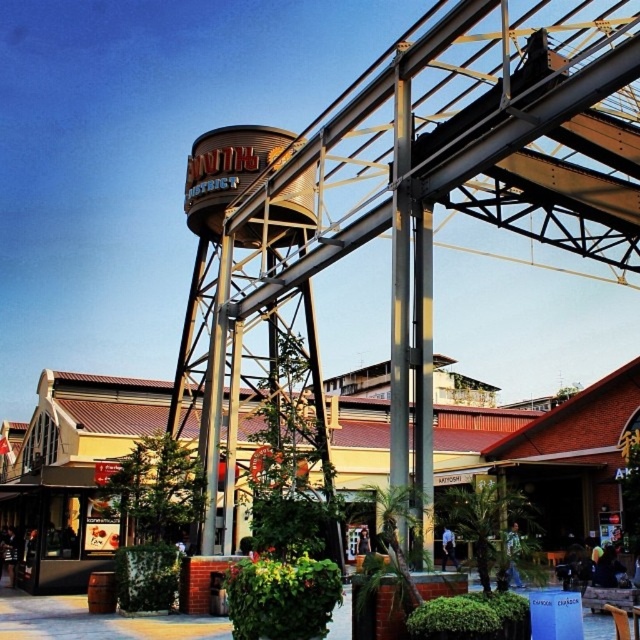
Question: Among these objects, which one is nearest to the camera?

Choices:
 (A) brown wooden amusement park at center
 (B) brown metallic water tower at center

Answer: (B)

Question: From the image, what is the correct spatial relationship of brown metallic water tower at center in relation to brown wooden amusement park at center?

Choices:
 (A) right
 (B) left

Answer: (A)

Question: Does brown metallic water tower at center appear on the right side of brown wooden amusement park at center?

Choices:
 (A) yes
 (B) no

Answer: (A)

Question: Among these objects, which one is farthest from the camera?

Choices:
 (A) brown metallic water tower at center
 (B) brown wooden amusement park at center

Answer: (B)

Question: Observing the image, what is the correct spatial positioning of brown metallic water tower at center in reference to brown wooden amusement park at center?

Choices:
 (A) below
 (B) above

Answer: (B)

Question: Which point is closer to the camera?

Choices:
 (A) (481, 472)
 (B) (284, 396)

Answer: (B)